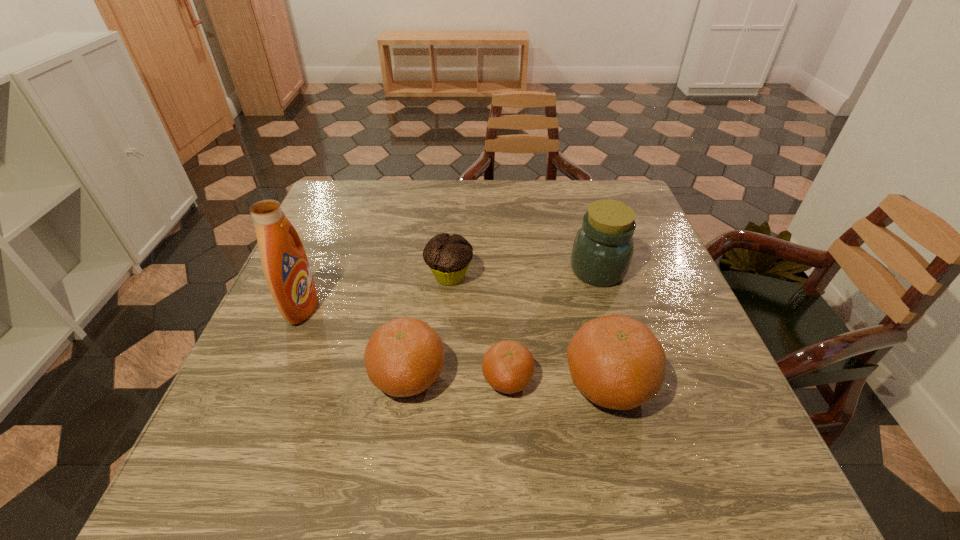
What are the coordinates of `vacant space at the right edge` in the screenshot? It's located at (642, 228).

Where is `vacant space at the far left corner`? vacant space at the far left corner is located at coordinates (329, 184).

I want to click on blank space at the far right corner of the desktop, so click(x=625, y=186).

You are a GUI agent. You are given a task and a screenshot of the screen. Output one action in this format:
    pyautogui.click(x=<x>, y=<y>)
    Task: Click on the vacant space at the near right corner of the desktop
    This screenshot has width=960, height=540.
    Given the screenshot: What is the action you would take?
    [x=656, y=423]

At what (x,y) coordinates should I click in order to perform the action: click on unoccupied area between the leftmost clementine and the detergent. Please return your answer as a coordinate pair (x, y). This screenshot has height=540, width=960. Looking at the image, I should click on (355, 341).

Find the location of a particular element. This screenshot has width=960, height=540. vacant space in between the second tallest clementine and the jar is located at coordinates (503, 323).

At what (x,y) coordinates should I click in order to perform the action: click on free spot between the shortest clementine and the muffin. Please return your answer as a coordinate pair (x, y). Looking at the image, I should click on (478, 328).

What are the coordinates of `empty space between the second clementine from right to left and the fifth shortest object` in the screenshot? It's located at (553, 325).

Where is `free space between the second clementine from right to left and the muffin`? The width and height of the screenshot is (960, 540). free space between the second clementine from right to left and the muffin is located at coordinates (478, 328).

Where is `vacant area that lies between the muffin and the rightmost clementine`? The height and width of the screenshot is (540, 960). vacant area that lies between the muffin and the rightmost clementine is located at coordinates (529, 330).